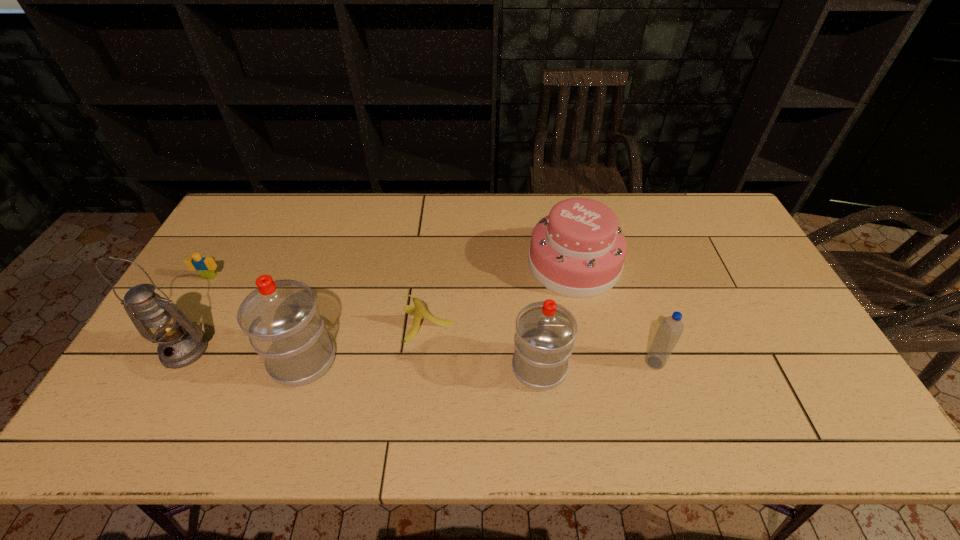
The width and height of the screenshot is (960, 540). I want to click on free space located 0.330m on the left of the shortest water bottle, so coord(516,362).

The image size is (960, 540). Identify the location of object situated at the far edge. (578, 250).

Find the location of a particular element. The image size is (960, 540). Lego at the left edge is located at coordinates (205, 266).

This screenshot has height=540, width=960. In order to click on oil lamp present at the left edge in this screenshot , I will do tap(181, 343).

Where is `vacant region at the far edge of the desktop`? The image size is (960, 540). vacant region at the far edge of the desktop is located at coordinates (558, 197).

Identify the location of vacant space at the near edge of the desktop. The height and width of the screenshot is (540, 960). (311, 403).

You are a GUI agent. You are given a task and a screenshot of the screen. Output one action in this format:
    pyautogui.click(x=<x>, y=<y>)
    Task: Click on the vacant space at the left edge
    The image size is (960, 540).
    Given the screenshot: What is the action you would take?
    pyautogui.click(x=234, y=245)

This screenshot has width=960, height=540. In the image, there is a desktop. Find the location of `free region at the right edge`. free region at the right edge is located at coordinates (760, 291).

Find the location of a particular element. vacant space that's between the leftmost water bottle and the fifth shortest object is located at coordinates (421, 364).

Where is `free space that is in between the rightmost water bottle and the third tallest object`? free space that is in between the rightmost water bottle and the third tallest object is located at coordinates (597, 365).